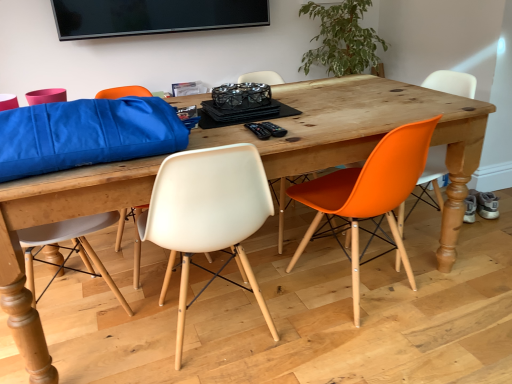
The width and height of the screenshot is (512, 384). Find the location of `free space that is to the left of black plastic remote control at center, which is the 2th remote control in right-to-left order`. free space that is to the left of black plastic remote control at center, which is the 2th remote control in right-to-left order is located at coordinates (222, 134).